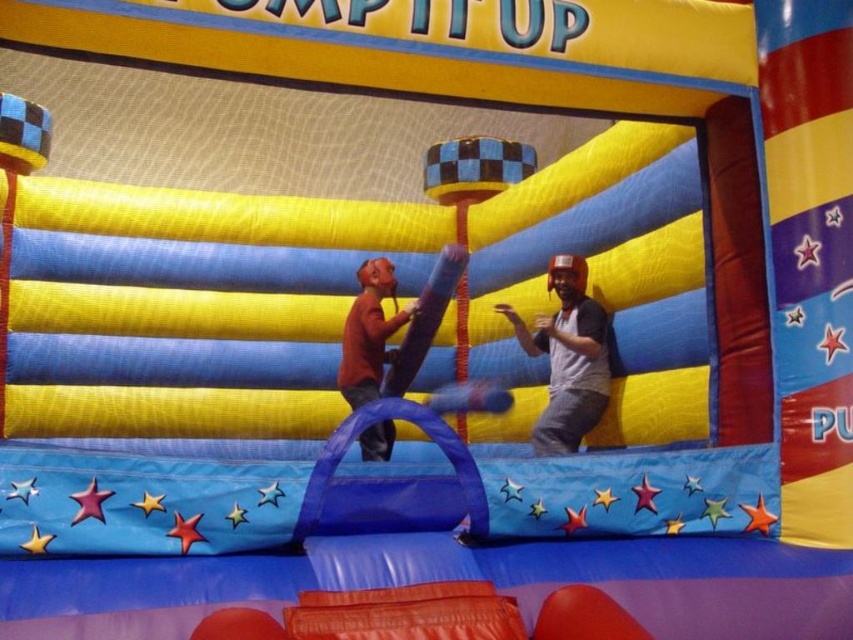
Can you confirm if gray matte helmet at upper right is positioned to the right of matte brown shirt at center?

Indeed, gray matte helmet at upper right is positioned on the right side of matte brown shirt at center.

Does gray matte helmet at upper right appear over matte brown shirt at center?

Yes.

At what (x,y) coordinates should I click in order to perform the action: click on gray matte helmet at upper right. Please return your answer as a coordinate pair (x, y). This screenshot has height=640, width=853. Looking at the image, I should click on coord(567,358).

Locate an element on the screen. The width and height of the screenshot is (853, 640). gray matte helmet at upper right is located at coordinates (567, 358).